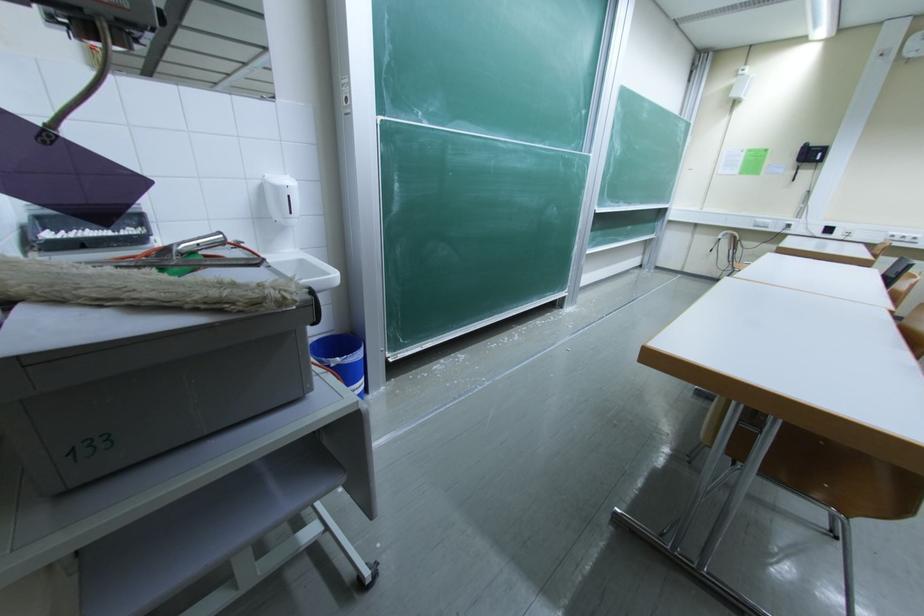
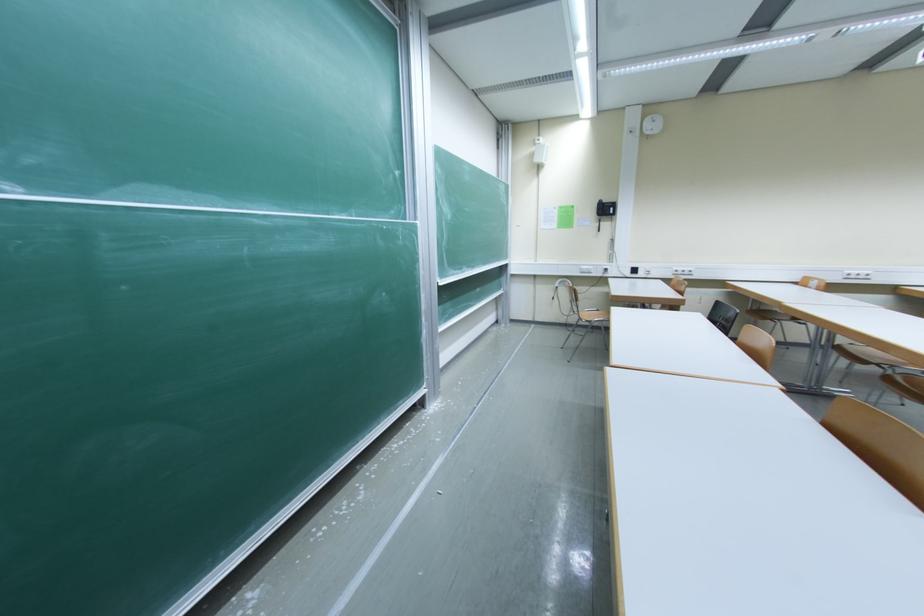
Question: The first image is from the beginning of the video and the second image is from the end. How did the camera likely rotate when shooting the video?

Choices:
 (A) Left
 (B) Right
 (C) Up
 (D) Down

Answer: (B)